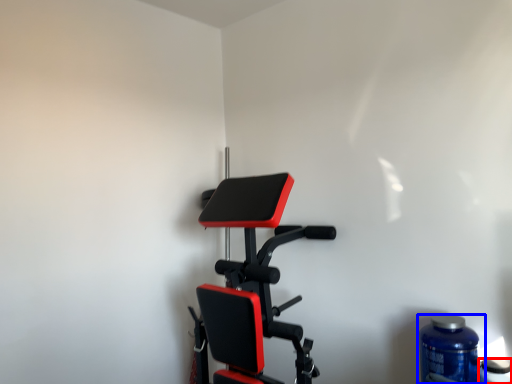
Question: Which point is further to the camera, bottle (highlighted by a red box) or bottle (highlighted by a blue box)?

Choices:
 (A) bottle
 (B) bottle

Answer: (B)